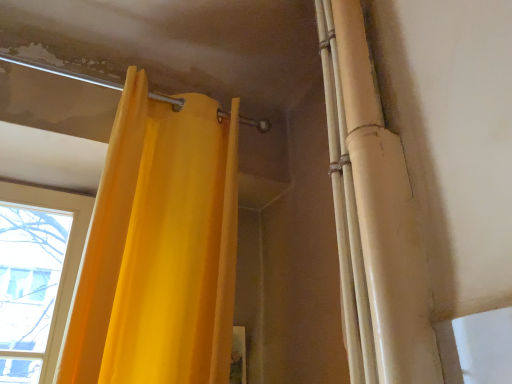
This screenshot has height=384, width=512. What do you see at coordinates (372, 215) in the screenshot?
I see `matte yellow curtain at upper right` at bounding box center [372, 215].

Find the location of a particular element. The height and width of the screenshot is (384, 512). matte yellow curtain at upper right is located at coordinates (372, 215).

You are a GUI agent. You are given a task and a screenshot of the screen. Output one action in this format:
    pyautogui.click(x=<x>, y=<y>)
    Task: Click on the matte yellow curtain at upper left
    This screenshot has width=512, height=384.
    Given the screenshot: What is the action you would take?
    pyautogui.click(x=159, y=248)

What do you see at coordinates (159, 248) in the screenshot? I see `matte yellow curtain at upper left` at bounding box center [159, 248].

Looking at this image, measure the distance between point [117,131] and camera.

A distance of 4.27 feet exists between point [117,131] and camera.

Where is `matte yellow curtain at upper right`? This screenshot has height=384, width=512. matte yellow curtain at upper right is located at coordinates (372, 215).

Is matte yellow curtain at upper right to the left or to the right of matte yellow curtain at upper left in the image?

In the image, matte yellow curtain at upper right appears on the right side of matte yellow curtain at upper left.

Is matte yellow curtain at upper right further to the viewer compared to matte yellow curtain at upper left?

That is False.

Is point (352, 60) closer to viewer compared to point (174, 212)?

Yes, it is in front of point (174, 212).

From the picture: From the image's perspective, is matte yellow curtain at upper right beneath matte yellow curtain at upper left?

No, from the image's perspective, matte yellow curtain at upper right is not below matte yellow curtain at upper left.

From a real-world perspective, is matte yellow curtain at upper right located higher than matte yellow curtain at upper left?

Yes, from a real-world perspective, matte yellow curtain at upper right is above matte yellow curtain at upper left.

Is matte yellow curtain at upper right thinner than matte yellow curtain at upper left?

Yes, matte yellow curtain at upper right is thinner than matte yellow curtain at upper left.

Does matte yellow curtain at upper right have a lesser height compared to matte yellow curtain at upper left?

No.

Considering the sizes of objects matte yellow curtain at upper right and matte yellow curtain at upper left in the image provided, who is smaller, matte yellow curtain at upper right or matte yellow curtain at upper left?

Smaller between the two is matte yellow curtain at upper right.

Is matte yellow curtain at upper right positioned beyond the bounds of matte yellow curtain at upper left?

Yes, matte yellow curtain at upper right is not within matte yellow curtain at upper left.

Would you consider matte yellow curtain at upper right to be distant from matte yellow curtain at upper left?

No, matte yellow curtain at upper right is not far away from matte yellow curtain at upper left.

Is matte yellow curtain at upper right looking in the opposite direction of matte yellow curtain at upper left?

That's not correct — matte yellow curtain at upper right is not looking away from matte yellow curtain at upper left.

Can you tell me how much matte yellow curtain at upper right and matte yellow curtain at upper left differ in facing direction?

They differ by 91.7 degrees in their facing directions.

Locate an element on the screen. shower curtain in front of the matte yellow curtain at upper left is located at coordinates (372, 215).

Considering the relative positions of matte yellow curtain at upper left and matte yellow curtain at upper right in the image provided, is matte yellow curtain at upper left to the right of matte yellow curtain at upper right from the viewer's perspective?

In fact, matte yellow curtain at upper left is to the left of matte yellow curtain at upper right.

Considering their positions, is matte yellow curtain at upper left located in front of or behind matte yellow curtain at upper right?

matte yellow curtain at upper left is positioned farther from the viewer than matte yellow curtain at upper right.

Between point (180, 196) and point (337, 183), which one is positioned behind?

The point (180, 196) is more distant.

From the image's perspective, is matte yellow curtain at upper left positioned above or below matte yellow curtain at upper right?

→ matte yellow curtain at upper left is situated lower than matte yellow curtain at upper right in the image.

From a real-world perspective, is matte yellow curtain at upper left physically below matte yellow curtain at upper right?

Yes, from a real-world perspective, matte yellow curtain at upper left is beneath matte yellow curtain at upper right.

Which object is thinner, matte yellow curtain at upper left or matte yellow curtain at upper right?

With smaller width is matte yellow curtain at upper right.

Which of these two, matte yellow curtain at upper left or matte yellow curtain at upper right, stands shorter?

Standing shorter between the two is matte yellow curtain at upper left.

Is matte yellow curtain at upper left smaller than matte yellow curtain at upper right?

No, matte yellow curtain at upper left is not smaller than matte yellow curtain at upper right.

Would you say matte yellow curtain at upper left is inside or outside matte yellow curtain at upper right?

matte yellow curtain at upper left is spatially situated outside matte yellow curtain at upper right.

Would you say matte yellow curtain at upper left is a long distance from matte yellow curtain at upper right?

matte yellow curtain at upper left is actually quite close to matte yellow curtain at upper right.

Looking at this image, is matte yellow curtain at upper left facing away from matte yellow curtain at upper right?

No, matte yellow curtain at upper right is not at the back of matte yellow curtain at upper left.

How distant is matte yellow curtain at upper left from matte yellow curtain at upper right?

23.19 inches.

In order to click on curtain on the left of matte yellow curtain at upper right in this screenshot , I will do `click(159, 248)`.

Locate an element on the screen. This screenshot has width=512, height=384. curtain behind the matte yellow curtain at upper right is located at coordinates (159, 248).

Where is `curtain located on the left of matte yellow curtain at upper right`? This screenshot has height=384, width=512. curtain located on the left of matte yellow curtain at upper right is located at coordinates (159, 248).